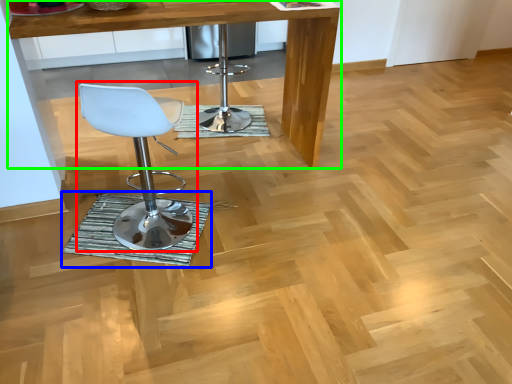
Question: Which is nearer to the chair (highlighted by a red box)? mat (highlighted by a blue box) or table (highlighted by a green box).

Choices:
 (A) mat
 (B) table

Answer: (A)